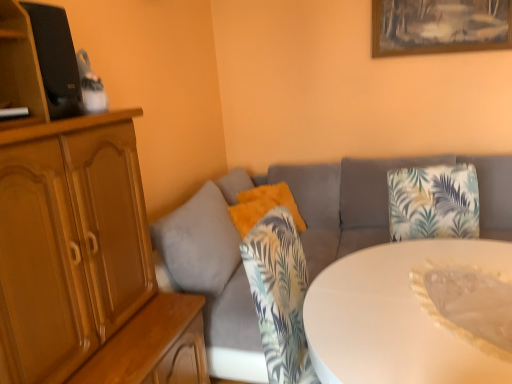
Question: Is white glossy table at center in contact with fuzzy orange pillow at center?

Choices:
 (A) yes
 (B) no

Answer: (B)

Question: Considering the relative sizes of white glossy table at center and fuzzy orange pillow at center in the image provided, is white glossy table at center bigger than fuzzy orange pillow at center?

Choices:
 (A) yes
 (B) no

Answer: (A)

Question: Can you confirm if white glossy table at center is smaller than fuzzy orange pillow at center?

Choices:
 (A) yes
 (B) no

Answer: (B)

Question: Considering the relative sizes of white glossy table at center and fuzzy orange pillow at center in the image provided, is white glossy table at center shorter than fuzzy orange pillow at center?

Choices:
 (A) yes
 (B) no

Answer: (B)

Question: Is white glossy table at center further to camera compared to fuzzy orange pillow at center?

Choices:
 (A) yes
 (B) no

Answer: (B)

Question: From their relative heights in the image, would you say wooden cabinet at upper left is taller or shorter than gray fabric couch at center?

Choices:
 (A) tall
 (B) short

Answer: (B)

Question: In the image, is wooden cabinet at upper left on the left side or the right side of gray fabric couch at center?

Choices:
 (A) right
 (B) left

Answer: (B)

Question: Is wooden cabinet at upper left situated inside gray fabric couch at center or outside?

Choices:
 (A) outside
 (B) inside

Answer: (A)

Question: From a real-world perspective, is wooden cabinet at upper left positioned above or below gray fabric couch at center?

Choices:
 (A) above
 (B) below

Answer: (A)

Question: From the image's perspective, is fuzzy orange pillow at center located above or below white glossy table at center?

Choices:
 (A) above
 (B) below

Answer: (A)

Question: From a real-world perspective, is fuzzy orange pillow at center positioned above or below white glossy table at center?

Choices:
 (A) above
 (B) below

Answer: (A)

Question: Is fuzzy orange pillow at center taller or shorter than white glossy table at center?

Choices:
 (A) tall
 (B) short

Answer: (B)

Question: Is fuzzy orange pillow at center wider or thinner than white glossy table at center?

Choices:
 (A) thin
 (B) wide

Answer: (A)

Question: Would you say gray fabric couch at center is inside or outside wooden picture frame at upper center?

Choices:
 (A) inside
 (B) outside

Answer: (B)

Question: Considering the positions of gray fabric couch at center and wooden picture frame at upper center in the image, is gray fabric couch at center bigger or smaller than wooden picture frame at upper center?

Choices:
 (A) big
 (B) small

Answer: (A)